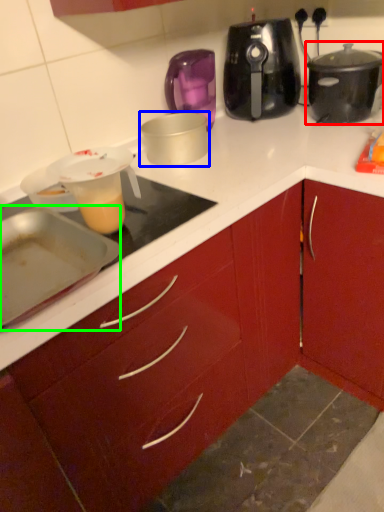
Question: Which object is positioned closest to slow cooker (highlighted by a red box)? Select from kitchen appliance (highlighted by a blue box) and kitchen appliance (highlighted by a green box).

Choices:
 (A) kitchen appliance
 (B) kitchen appliance

Answer: (A)